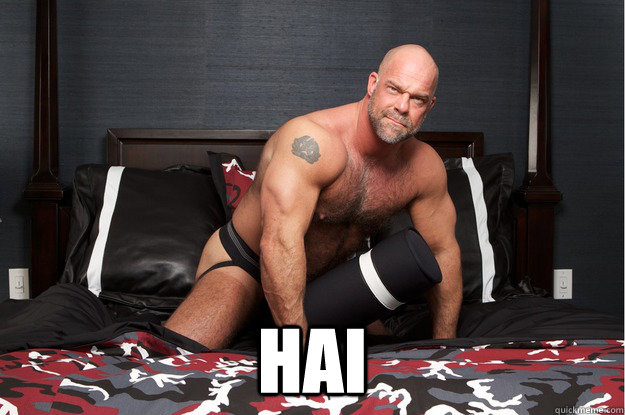
At what (x,y) coordinates should I click in order to perform the action: click on black bed sheet. Please return your answer as a coordinate pair (x, y). The height and width of the screenshot is (415, 625). Looking at the image, I should click on (558, 321).